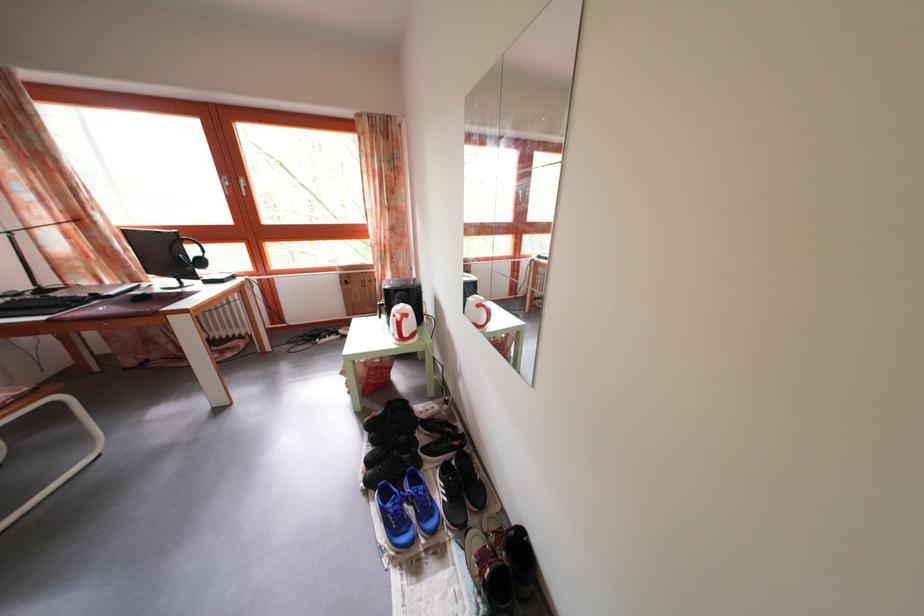
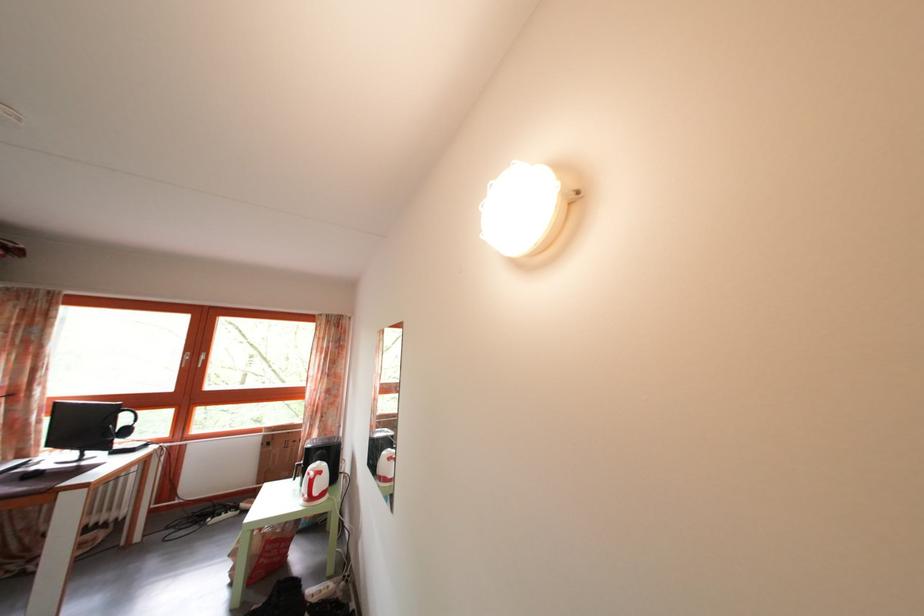
In the second image, find the point that corresponds to (x=334, y=338) in the first image.

(233, 514)